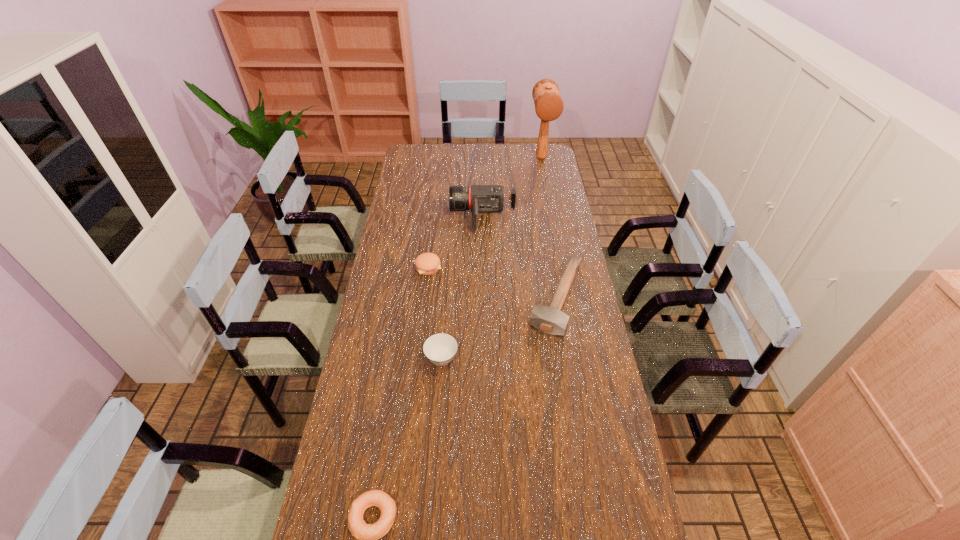
You are a GUI agent. You are given a task and a screenshot of the screen. Output one action in this format:
    pyautogui.click(x=<x>, y=<y>)
    Task: Click on the vacant point at the far right corner
    
    Given the screenshot: What is the action you would take?
    pyautogui.click(x=530, y=158)

This screenshot has width=960, height=540. In order to click on empty space between the patty and the farther mallet in this screenshot , I will do `click(485, 213)`.

In order to click on unoccupied position between the second nearest object and the taller mallet in this screenshot , I will do `click(492, 258)`.

Identify the location of vacant space in between the second tallest object and the shorter mallet. (519, 256).

This screenshot has width=960, height=540. I want to click on vacant area that lies between the second nearest object and the tallest object, so click(x=492, y=258).

You are a GUI agent. You are given a task and a screenshot of the screen. Output one action in this format:
    pyautogui.click(x=<x>, y=<y>)
    Task: Click on the free space between the nearer mallet and the taller mallet
    This screenshot has width=960, height=540.
    Given the screenshot: What is the action you would take?
    tap(549, 228)

Select which object is the second closest to the tallest object. Please provide its 2D coordinates. Your answer should be formatted as a tuple, i.e. [(x, y)], where the tuple contains the x and y coordinates of a point satisfying the conditions above.

[(550, 319)]

Identify the location of object that ranks as the closest to the patty. (479, 198).

Where is `free location that satisfies the following two spatial constraints: 1. on the lens of the nearer mallet; 2. on the right side of the camcorder`? This screenshot has width=960, height=540. free location that satisfies the following two spatial constraints: 1. on the lens of the nearer mallet; 2. on the right side of the camcorder is located at coordinates (484, 298).

The image size is (960, 540). Identify the location of vacant position in the image that satisfies the following two spatial constraints: 1. on the lens of the shorter mallet; 2. on the right side of the camcorder. coord(484,298).